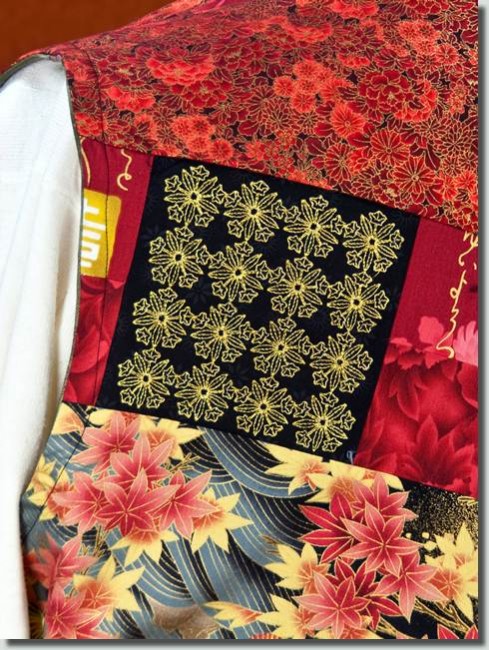
Locate an element on the screen. wall is located at coordinates (67, 12).